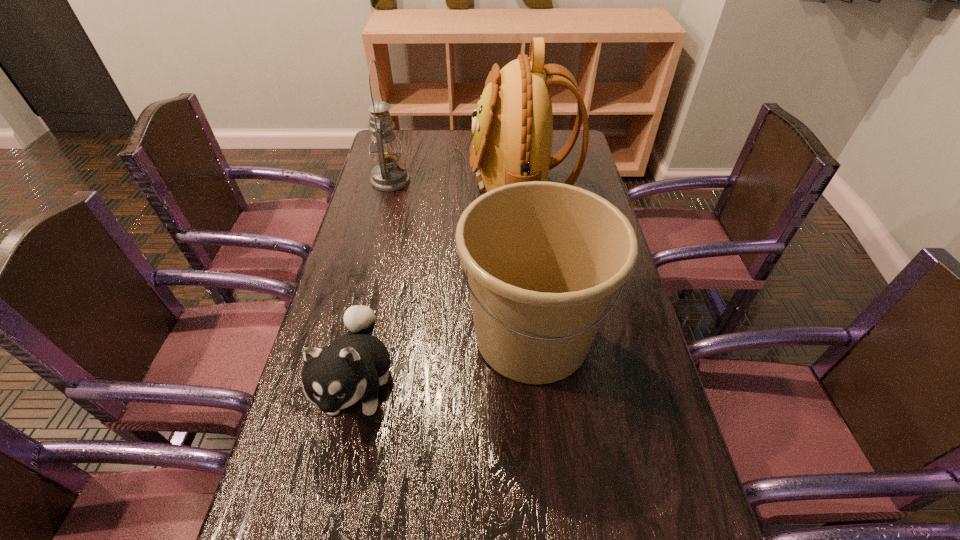
Identify the location of free space between the shortest object and the tallest object. (440, 286).

Where is `empty space that is in between the second tallest object and the tallest object`? empty space that is in between the second tallest object and the tallest object is located at coordinates (x=456, y=184).

This screenshot has width=960, height=540. What are the coordinates of `free space between the shortest object and the third tallest object` in the screenshot? It's located at (445, 360).

In order to click on free spot between the shortest object and the second tallest object in this screenshot , I will do `click(374, 282)`.

Image resolution: width=960 pixels, height=540 pixels. Identify the location of vacant area that lies between the tallest object and the shortest object. (440, 286).

Identify the location of free spot between the puppy and the tallest object. The width and height of the screenshot is (960, 540). (440, 286).

The width and height of the screenshot is (960, 540). What are the coordinates of `empty location between the second tallest object and the backpack` in the screenshot? It's located at (456, 184).

Locate which object is the closest to the third tallest object. Please provide its 2D coordinates. Your answer should be formatted as a tuple, i.e. [(x, y)], where the tuple contains the x and y coordinates of a point satisfying the conditions above.

[(353, 366)]

The height and width of the screenshot is (540, 960). What are the coordinates of `object that is the closest to the oil lamp` in the screenshot? It's located at (512, 128).

At what (x,y) coordinates should I click in order to perform the action: click on vacant area in the image that satisfies the following two spatial constraints: 1. on the front-facing side of the tallest object; 2. at the face of the puppy. Please return your answer as a coordinate pair (x, y). The width and height of the screenshot is (960, 540). Looking at the image, I should click on (544, 384).